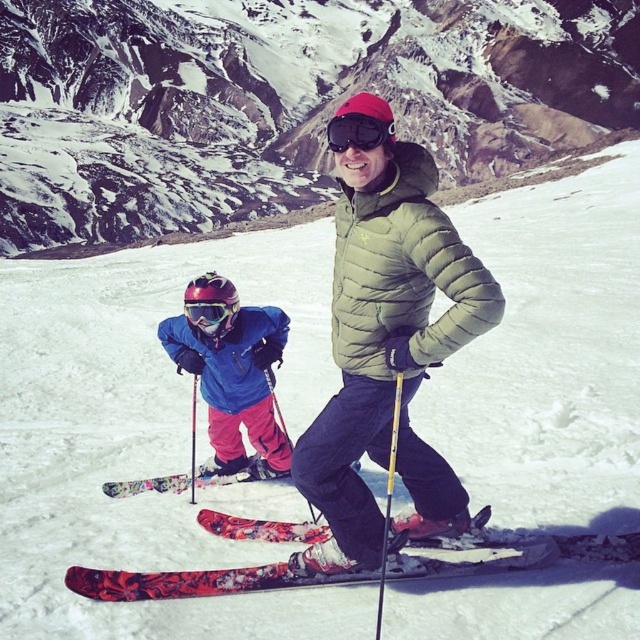
You are a photographer trying to capture the skiers in the snowy mountain scene. You notice a specific point marked at coordinates (205, 580). What object is located at that point?

The floral patterned skis at center are located at point (205, 580).